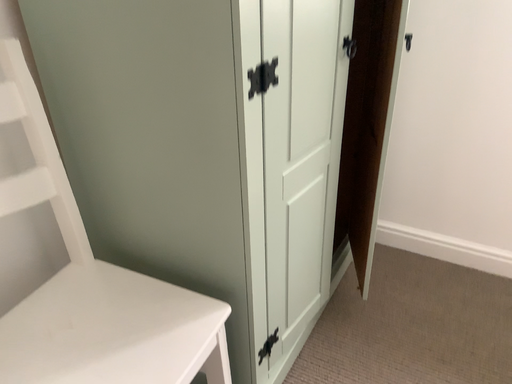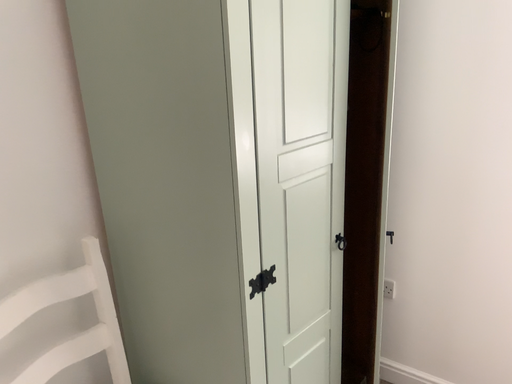
Question: How did the camera likely rotate when shooting the video?

Choices:
 (A) rotated right
 (B) rotated left

Answer: (B)